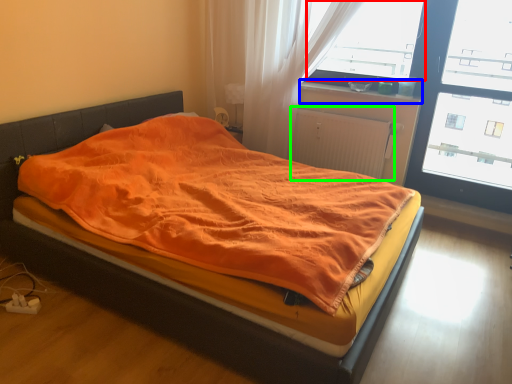
Question: Based on their relative distances, which object is nearer to window screen (highlighted by a red box)? Choose from window sill (highlighted by a blue box) and radiator (highlighted by a green box).

Choices:
 (A) window sill
 (B) radiator

Answer: (A)